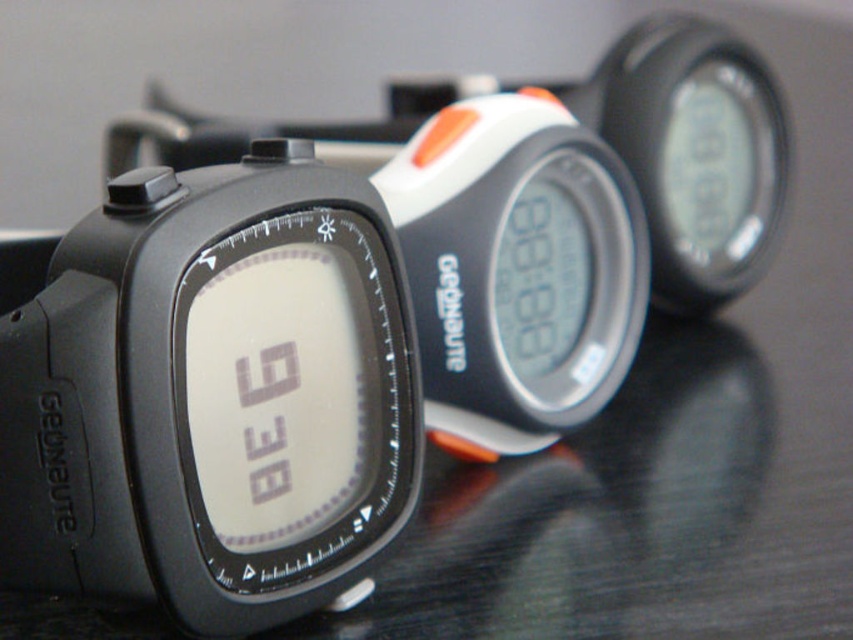
You are holding a smartphone and want to take a photo of the watch at point (294, 320). The camera is currently 1.09 meters away from the watch. If you move the camera 0.5 meters closer, will the watch be in focus? Assume the minimum focus distance of the smartphone camera is 0.3 meters.

Moving the camera 0.5 meters closer would bring it to 0.59 meters from the watch at point (294, 320). Since the minimum focus distance is 0.3 meters, the watch will still be within the focus range and in focus.

You are trying to choose between the black matte watch at center and the white plastic watch at center for a formal event. Considering their sizes, which one might be more appropriate for a formal outfit?

The black matte watch at center is much taller than the white plastic watch at center, so it might be more appropriate for a formal outfit as larger watches can add a bold statement to formal attire.